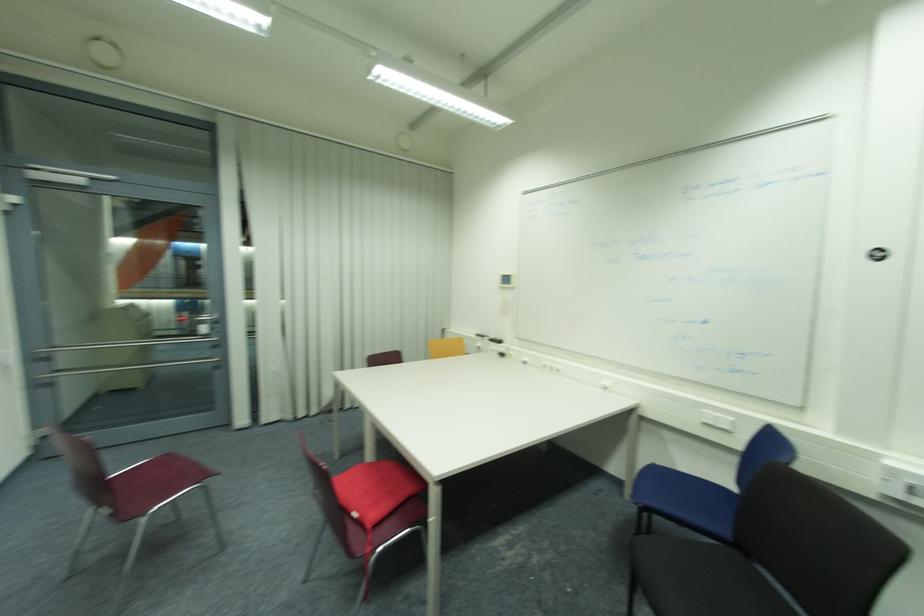
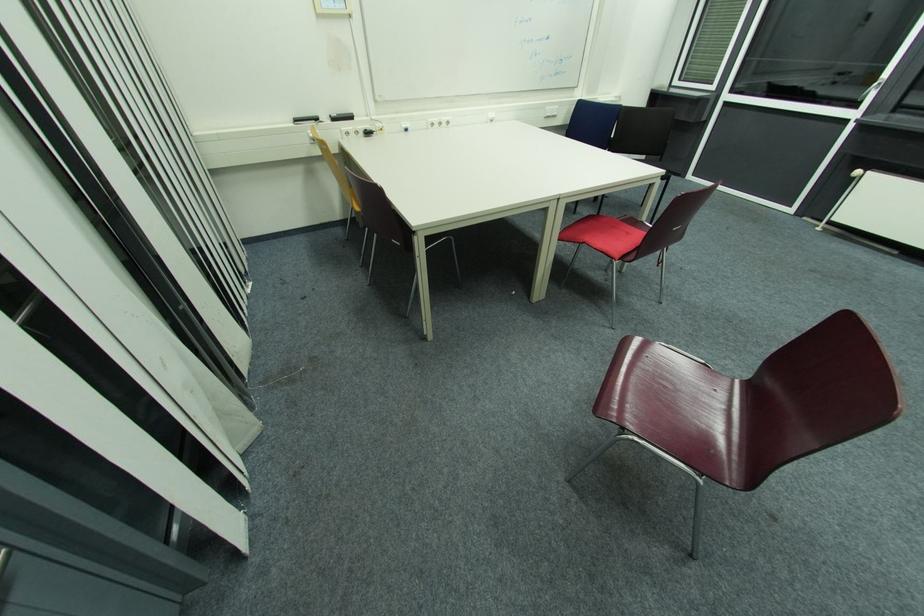
The point at (481,336) is marked in the first image. Where is the corresponding point in the second image?

(300, 121)